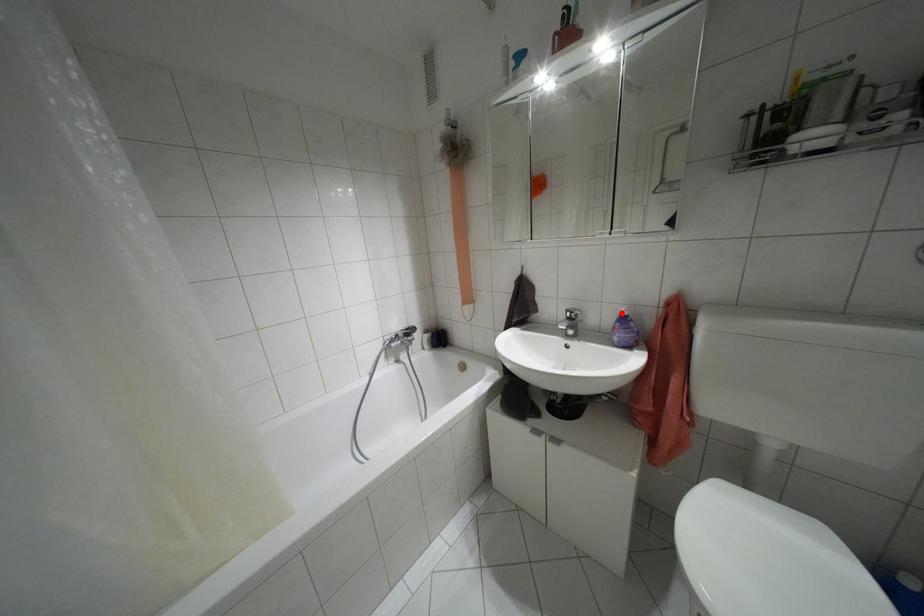
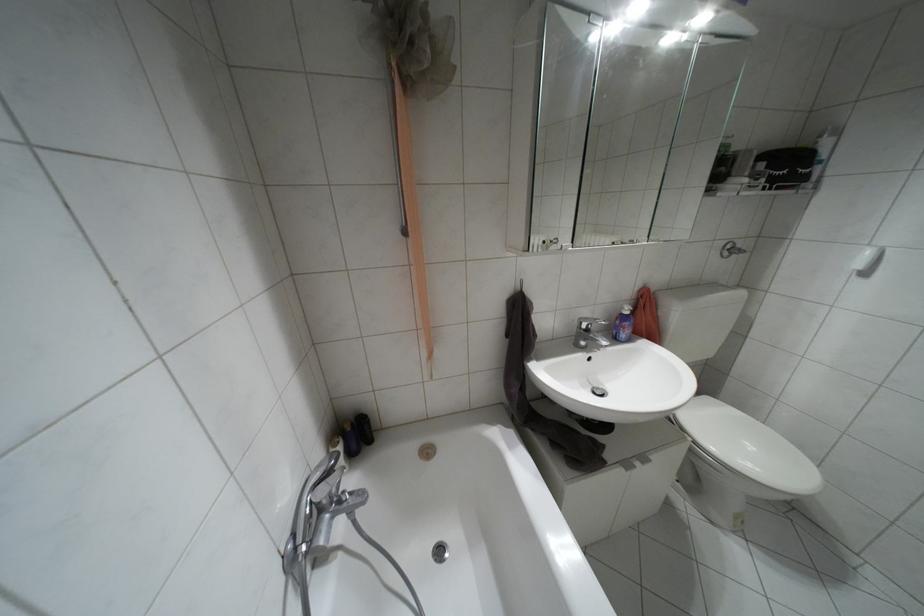
Locate, in the second image, the point that corresponds to the highlighted location in the first image.

(626, 312)